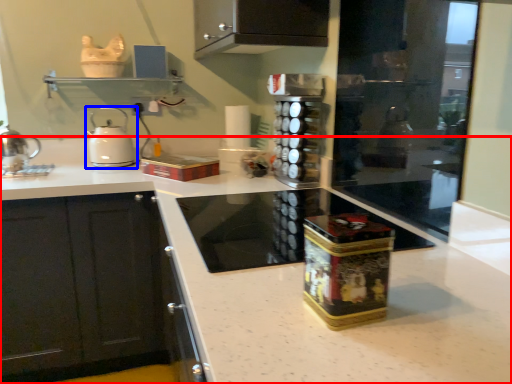
Question: Which object is closer to the camera taking this photo, countertop (highlighted by a red box) or kitchen appliance (highlighted by a blue box)?

Choices:
 (A) countertop
 (B) kitchen appliance

Answer: (A)